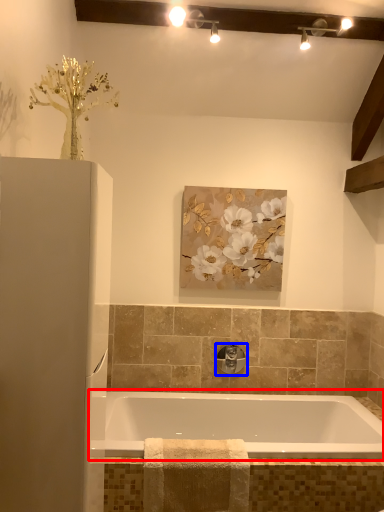
Question: Which object is closer to the camera taking this photo, bathtub (highlighted by a red box) or tap (highlighted by a blue box)?

Choices:
 (A) bathtub
 (B) tap

Answer: (A)